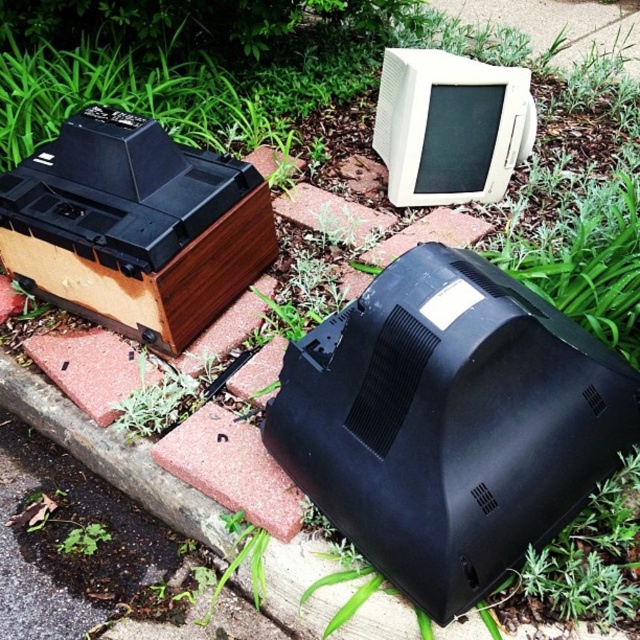
Does black matte monitor at center have a greater height compared to white plastic monitor at upper center?

Correct, black matte monitor at center is much taller as white plastic monitor at upper center.

Can you confirm if black matte monitor at center is thinner than white plastic monitor at upper center?

Incorrect, black matte monitor at center's width is not less than white plastic monitor at upper center's.

Which is in front, point (632, 436) or point (454, 170)?

Point (632, 436) is in front.

The width and height of the screenshot is (640, 640). What are the coordinates of `black matte monitor at center` in the screenshot? It's located at (449, 422).